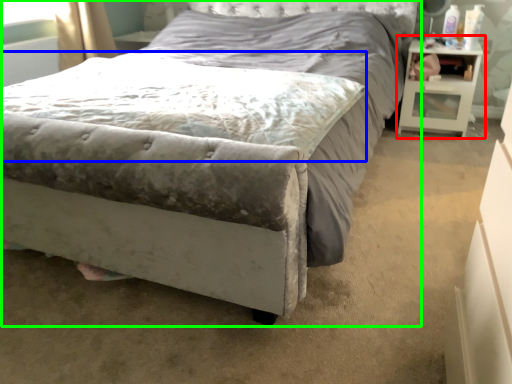
Question: Estimate the real-world distances between objects in this image. Which object is closer to nightstand (highlighted by a red box), mattress (highlighted by a blue box) or bed (highlighted by a green box)?

Choices:
 (A) mattress
 (B) bed

Answer: (B)